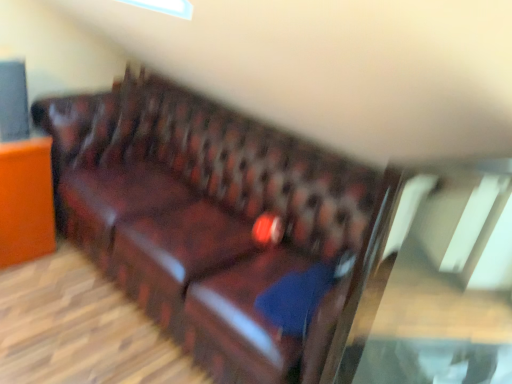
Question: Does matte brown leather sofa at left turn towards transparent glass table at center?

Choices:
 (A) yes
 (B) no

Answer: (A)

Question: Does matte brown leather sofa at left lie behind transparent glass table at center?

Choices:
 (A) yes
 (B) no

Answer: (A)

Question: Does matte brown leather sofa at left have a lesser width compared to transparent glass table at center?

Choices:
 (A) no
 (B) yes

Answer: (A)

Question: Considering the relative sizes of matte brown leather sofa at left and transparent glass table at center in the image provided, is matte brown leather sofa at left taller than transparent glass table at center?

Choices:
 (A) yes
 (B) no

Answer: (B)

Question: Is matte brown leather sofa at left surrounding transparent glass table at center?

Choices:
 (A) no
 (B) yes

Answer: (A)

Question: From the image's perspective, is matte brown leather sofa at left below transparent glass table at center?

Choices:
 (A) no
 (B) yes

Answer: (A)

Question: Does blue fabric pillow at center have a lesser height compared to matte brown leather sofa at left?

Choices:
 (A) yes
 (B) no

Answer: (A)

Question: Is blue fabric pillow at center wider than matte brown leather sofa at left?

Choices:
 (A) no
 (B) yes

Answer: (A)

Question: Is the position of blue fabric pillow at center more distant than that of matte brown leather sofa at left?

Choices:
 (A) yes
 (B) no

Answer: (B)

Question: Is matte brown leather sofa at left a part of blue fabric pillow at center?

Choices:
 (A) yes
 (B) no

Answer: (B)

Question: Considering the relative sizes of blue fabric pillow at center and matte brown leather sofa at left in the image provided, is blue fabric pillow at center thinner than matte brown leather sofa at left?

Choices:
 (A) no
 (B) yes

Answer: (B)

Question: Can you confirm if blue fabric pillow at center is positioned to the left of matte brown leather sofa at left?

Choices:
 (A) yes
 (B) no

Answer: (B)

Question: Is matte brown leather sofa at left aimed at leather couch at center?

Choices:
 (A) yes
 (B) no

Answer: (B)